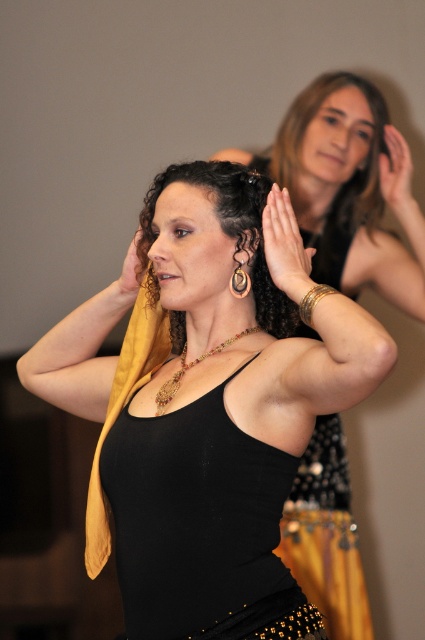
Question: Among these objects, which one is farthest from the camera?

Choices:
 (A) black matte tank top at center
 (B) golden metallic bracelet at upper center
 (C) smooth skin hand at upper right

Answer: (C)

Question: Does golden metallic bracelet at upper center have a larger size compared to gold metallic bracelet at upper center?

Choices:
 (A) yes
 (B) no

Answer: (A)

Question: Can you confirm if smooth brown hair at upper center is wider than multicolored beaded necklace at center?

Choices:
 (A) yes
 (B) no

Answer: (A)

Question: Among these objects, which one is nearest to the camera?

Choices:
 (A) brown leather hair clip at upper center
 (B) black matte tank top at center
 (C) golden metallic bracelet at upper center

Answer: (B)

Question: Is black matte tank top at center closer to camera compared to smooth brown hair at upper center?

Choices:
 (A) yes
 (B) no

Answer: (A)

Question: Which point is closer to the camera?

Choices:
 (A) (362, 212)
 (B) (300, 291)
 (C) (391, 144)
 (D) (133, 262)

Answer: (B)